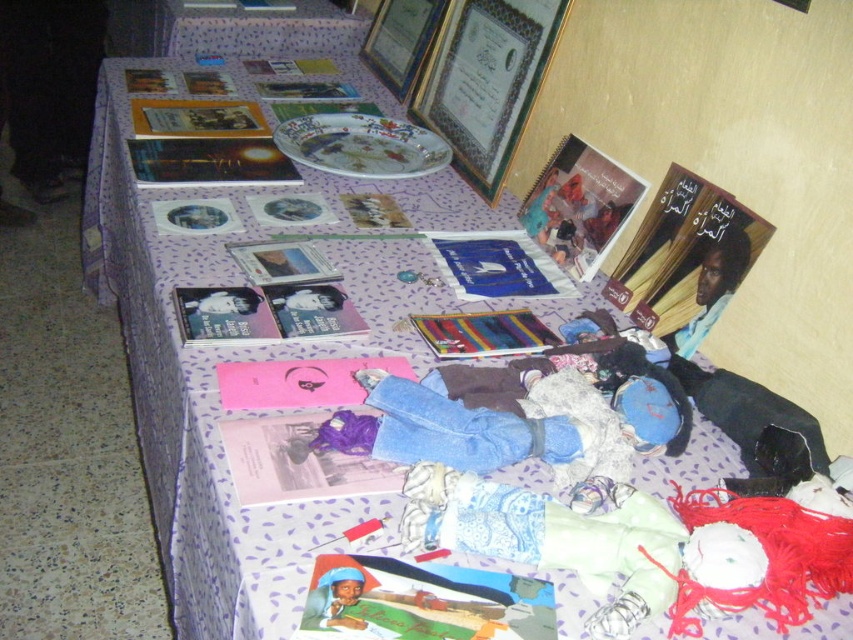
Question: Can you confirm if gold metallic picture frame at upper center is thinner than wooden picture frame at upper center?

Choices:
 (A) no
 (B) yes

Answer: (A)

Question: Is gold metallic picture frame at upper center to the left of wooden picture frame at upper center from the viewer's perspective?

Choices:
 (A) yes
 (B) no

Answer: (B)

Question: Is gold metallic picture frame at upper center wider than wooden picture frame at upper center?

Choices:
 (A) no
 (B) yes

Answer: (B)